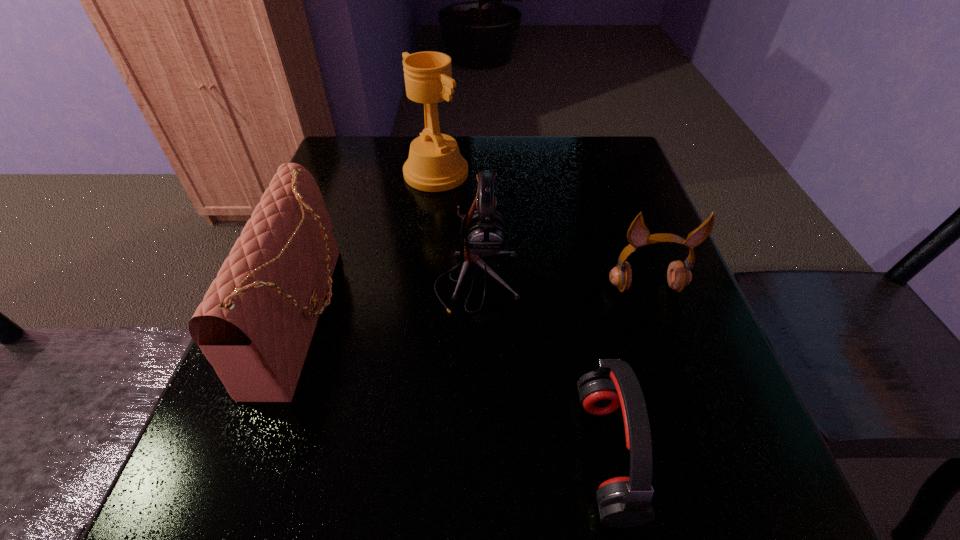
This screenshot has width=960, height=540. Find the location of `the tallest object`. the tallest object is located at coordinates (435, 164).

Identify the location of the farthest object. (x=435, y=164).

Locate an element on the screen. The width and height of the screenshot is (960, 540). the leftmost earphone is located at coordinates (483, 232).

Where is `the leftmost object`? Image resolution: width=960 pixels, height=540 pixels. the leftmost object is located at coordinates (255, 324).

The width and height of the screenshot is (960, 540). Find the location of `the rightmost object`. the rightmost object is located at coordinates (678, 276).

This screenshot has height=540, width=960. I want to click on the fourth object from left to right, so click(623, 502).

This screenshot has width=960, height=540. I want to click on the second earphone from left to right, so click(x=623, y=502).

Where is `free spot located 0.150m on the left of the award`? The width and height of the screenshot is (960, 540). free spot located 0.150m on the left of the award is located at coordinates (346, 173).

The image size is (960, 540). Identify the location of vacant space located on the left of the leftmost earphone. (399, 282).

This screenshot has height=540, width=960. In order to click on vacant space located on the front-facing side of the leftmost object in this screenshot , I will do coord(375,316).